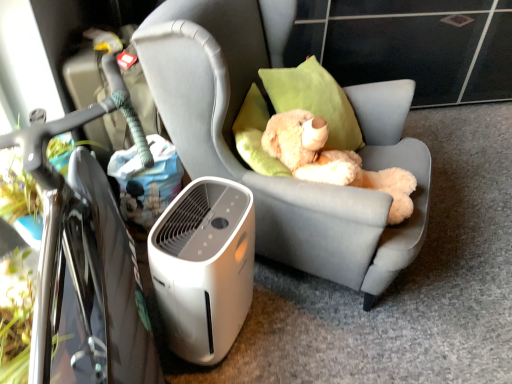
What do you see at coordinates (282, 177) in the screenshot? I see `light gray fabric chair at center` at bounding box center [282, 177].

What is the approximate height of light gray fabric chair at center?

It is 1.02 meters.

The width and height of the screenshot is (512, 384). Describe the element at coordinates (88, 249) in the screenshot. I see `black glossy bicycle at left` at that location.

You are a GUI agent. You are given a task and a screenshot of the screen. Output one action in this format:
    pyautogui.click(x=<x>, y=<y>)
    Task: Click on the fluffy beige teddy bear at center
    
    Given the screenshot: What is the action you would take?
    pyautogui.click(x=332, y=161)

The height and width of the screenshot is (384, 512). What are the coordinates of `white plastic air purifier at lower left` in the screenshot? It's located at (204, 267).

Locate an element on the screen. Image resolution: width=512 pixels, height=384 pixels. home appliance on the left of fluffy beige teddy bear at center is located at coordinates tap(204, 267).

Does fluffy beige teddy bear at center appear on the right side of white plastic air purifier at lower left?

Indeed, fluffy beige teddy bear at center is positioned on the right side of white plastic air purifier at lower left.

Which of these two, fluffy beige teddy bear at center or white plastic air purifier at lower left, is thinner?

white plastic air purifier at lower left.

From the picture: Is fluffy beige teddy bear at center looking in the opposite direction of white plastic air purifier at lower left?

No, fluffy beige teddy bear at center's orientation is not away from white plastic air purifier at lower left.

Based on their sizes in the image, would you say light gray fabric chair at center is bigger or smaller than fluffy beige teddy bear at center?

light gray fabric chair at center is bigger than fluffy beige teddy bear at center.

Locate an element on the screen. toy above the light gray fabric chair at center (from a real-world perspective) is located at coordinates 332,161.

Which is behind, light gray fabric chair at center or fluffy beige teddy bear at center?

fluffy beige teddy bear at center is behind.

Which of these two, light gray fabric chair at center or white plastic air purifier at lower left, is thinner?

white plastic air purifier at lower left is thinner.

From a real-world perspective, which is physically above, light gray fabric chair at center or white plastic air purifier at lower left?

In real-world perspective, light gray fabric chair at center is above.

Considering the relative positions of light gray fabric chair at center and white plastic air purifier at lower left in the image provided, is light gray fabric chair at center to the left or to the right of white plastic air purifier at lower left?

light gray fabric chair at center is positioned on white plastic air purifier at lower left's right side.

Locate an element on the screen. The width and height of the screenshot is (512, 384). chair in front of the white plastic air purifier at lower left is located at coordinates (282, 177).

What's the angular difference between white plastic air purifier at lower left and light gray fabric chair at center's facing directions?

The angular difference between white plastic air purifier at lower left and light gray fabric chair at center is 3.2 degrees.

Considering the relative positions of white plastic air purifier at lower left and light gray fabric chair at center in the image provided, is white plastic air purifier at lower left to the left or to the right of light gray fabric chair at center?

From the image, it's evident that white plastic air purifier at lower left is to the left of light gray fabric chair at center.

Is point (196, 231) more distant than point (140, 43)?

That is False.

Considering the sizes of white plastic air purifier at lower left and light gray fabric chair at center in the image, is white plastic air purifier at lower left bigger or smaller than light gray fabric chair at center?

In the image, white plastic air purifier at lower left appears to be smaller than light gray fabric chair at center.

From a real-world perspective, between white plastic air purifier at lower left and fluffy beige teddy bear at center, who is vertically higher?

In real-world perspective, fluffy beige teddy bear at center is above.

Is white plastic air purifier at lower left oriented towards fluffy beige teddy bear at center?

No, white plastic air purifier at lower left is not oriented towards fluffy beige teddy bear at center.

Which is correct: white plastic air purifier at lower left is inside fluffy beige teddy bear at center, or outside of it?

white plastic air purifier at lower left is outside fluffy beige teddy bear at center.

Who is more distant, white plastic air purifier at lower left or fluffy beige teddy bear at center?

Positioned behind is fluffy beige teddy bear at center.

Relative to black glossy bicycle at left, is fluffy beige teddy bear at center in front or behind?

fluffy beige teddy bear at center is positioned farther from the viewer than black glossy bicycle at left.

Could you tell me if fluffy beige teddy bear at center is turned towards black glossy bicycle at left?

No, fluffy beige teddy bear at center is not turned towards black glossy bicycle at left.

From a real-world perspective, who is located higher, fluffy beige teddy bear at center or black glossy bicycle at left?

fluffy beige teddy bear at center, from a real-world perspective.

From the image's perspective, is fluffy beige teddy bear at center located above or below black glossy bicycle at left?

Based on their image positions, fluffy beige teddy bear at center is located above black glossy bicycle at left.

Locate an element on the screen. bicycle located underneath the light gray fabric chair at center (from a real-world perspective) is located at coordinates (88, 249).

What's the angular difference between light gray fabric chair at center and black glossy bicycle at left's facing directions?

The angle between the facing direction of light gray fabric chair at center and the facing direction of black glossy bicycle at left is 36.4 degrees.

From the image's perspective, between light gray fabric chair at center and black glossy bicycle at left, who is located below?

black glossy bicycle at left.

Is the surface of light gray fabric chair at center in direct contact with black glossy bicycle at left?

They are not placed beside each other.

I want to click on toy that is above the white plastic air purifier at lower left (from a real-world perspective), so click(332, 161).

Where is `toy on the right side of light gray fabric chair at center`? toy on the right side of light gray fabric chair at center is located at coordinates (332, 161).

Which object lies further to the anchor point light gray fabric chair at center, white plastic air purifier at lower left or black glossy bicycle at left?

Based on the image, black glossy bicycle at left appears to be further to light gray fabric chair at center.

When comparing their distances from white plastic air purifier at lower left, does fluffy beige teddy bear at center or black glossy bicycle at left seem closer?

black glossy bicycle at left is closer to white plastic air purifier at lower left.

Which object lies further to the anchor point fluffy beige teddy bear at center, white plastic air purifier at lower left or light gray fabric chair at center?

white plastic air purifier at lower left is positioned further to the anchor fluffy beige teddy bear at center.

Considering their positions, is black glossy bicycle at left positioned further to white plastic air purifier at lower left than light gray fabric chair at center?

light gray fabric chair at center is positioned further to the anchor white plastic air purifier at lower left.

Looking at the image, which one is located closer to white plastic air purifier at lower left, light gray fabric chair at center or black glossy bicycle at left?

black glossy bicycle at left is closer to white plastic air purifier at lower left.

When comparing their distances from black glossy bicycle at left, does white plastic air purifier at lower left or fluffy beige teddy bear at center seem further?

fluffy beige teddy bear at center is further to black glossy bicycle at left.

From the image, which object appears to be farther from black glossy bicycle at left, light gray fabric chair at center or white plastic air purifier at lower left?

light gray fabric chair at center is further to black glossy bicycle at left.

Looking at the image, which one is located closer to black glossy bicycle at left, fluffy beige teddy bear at center or light gray fabric chair at center?

light gray fabric chair at center is positioned closer to the anchor black glossy bicycle at left.

This screenshot has width=512, height=384. In order to click on chair located between black glossy bicycle at left and fluffy beige teddy bear at center in the depth direction in this screenshot , I will do `click(282, 177)`.

Locate an element on the screen. This screenshot has height=384, width=512. home appliance between black glossy bicycle at left and fluffy beige teddy bear at center in the front-back direction is located at coordinates (x=204, y=267).

Locate an element on the screen. The width and height of the screenshot is (512, 384). toy between light gray fabric chair at center and white plastic air purifier at lower left from top to bottom is located at coordinates (332, 161).

Find the location of a particular element. chair between black glossy bicycle at left and white plastic air purifier at lower left from front to back is located at coordinates (282, 177).